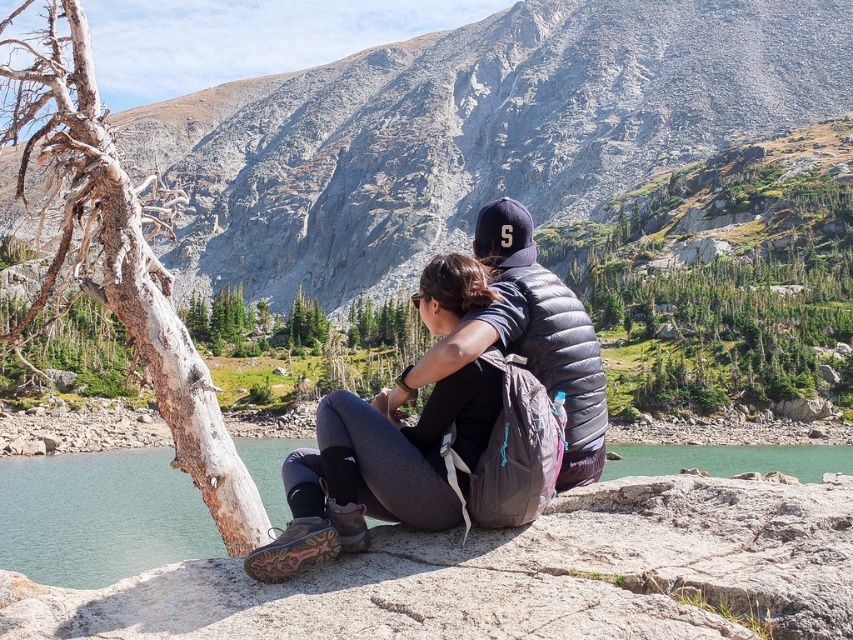
You are planning to place a small flag on the highest point between the matte gray rock at center and the matte black backpack at center. Based on their positions, which object should you choose to place the flag on?

The matte gray rock at center is positioned over the matte black backpack at center, so the matte gray rock at center is higher. Therefore, you should place the flag on the matte gray rock at center.

You are planning to place a small flag between the matte gray rock at center and the matte black backpack at center. Based on their positions, which object should the flag be closer to?

The flag should be placed closer to the matte black backpack at center because the matte gray rock at center is to the left of the matte black backpack at center, meaning the backpack is positioned to the right side of the rock.

You are a hiker planning to cross from the matte gray rock at center to the green smooth rock at lower center. Which rock will you step onto first?

You will step onto the matte gray rock at center first because it is closer to you than the green smooth rock at lower center.